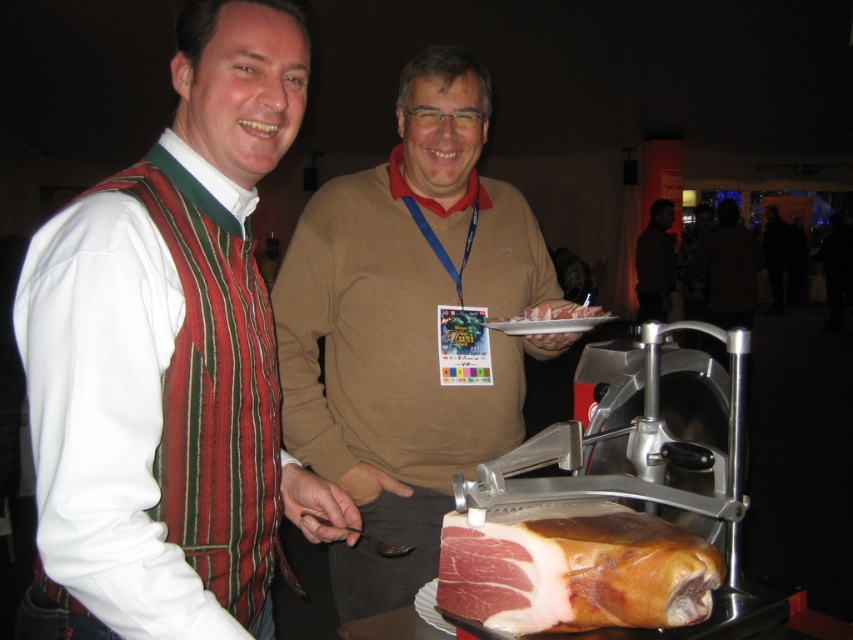
You are a guest at the event and want to take a photo of the pinkish raw meat at center without blocking the dark brown leather jacket at upper right. Can you position yourself so that the jacket is fully visible in the background?

The dark brown leather jacket at upper right might be wider than the pinkish raw meat at center, so positioning yourself to the side of the meat might allow both to be visible, but there is uncertainty due to their potential widths.